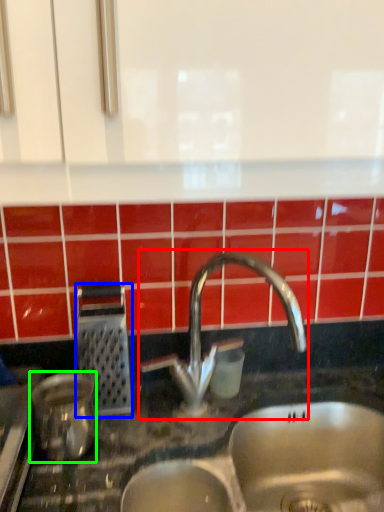
Question: Which object is the closest to the tap (highlighted by a red box)? Choose among these: appliance (highlighted by a blue box) or appliance (highlighted by a green box).

Choices:
 (A) appliance
 (B) appliance

Answer: (A)